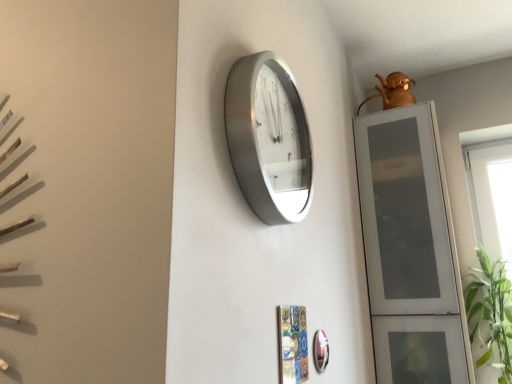
Question: From the image's perspective, relative to transparent glass window at right, is satin silver clock at center above or below?

Choices:
 (A) above
 (B) below

Answer: (A)

Question: Relative to transparent glass window at right, is satin silver clock at center in front or behind?

Choices:
 (A) behind
 (B) front

Answer: (B)

Question: Which object is positioned farthest from the shiny silver mirror at lower center?

Choices:
 (A) satin silver clock at center
 (B) transparent glass window at right
 (C) transparent glass cabinet at right

Answer: (B)

Question: Based on their relative distances, which object is nearer to the satin silver clock at center?

Choices:
 (A) transparent glass window at right
 (B) transparent glass cabinet at right
 (C) shiny silver mirror at lower center

Answer: (C)